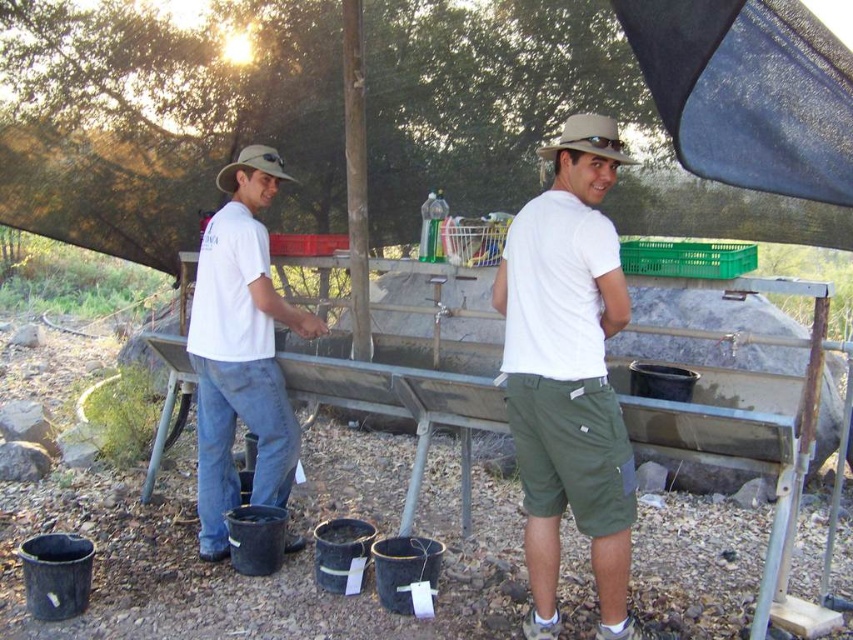
Question: Which point is closer to the camera?

Choices:
 (A) (221, 294)
 (B) (566, 413)

Answer: (B)

Question: Which object is farther from the camera taking this photo?

Choices:
 (A) white cotton shirt at center
 (B) denim jeans at left

Answer: (B)

Question: Which point is farther from the camera taking this photo?

Choices:
 (A) (271, 292)
 (B) (544, 536)

Answer: (A)

Question: Can you confirm if white cotton shirt at center is thinner than denim jeans at left?

Choices:
 (A) no
 (B) yes

Answer: (B)

Question: Does white cotton shirt at center have a greater width compared to denim jeans at left?

Choices:
 (A) no
 (B) yes

Answer: (A)

Question: Can you confirm if white cotton shirt at center is positioned to the right of denim jeans at left?

Choices:
 (A) yes
 (B) no

Answer: (A)